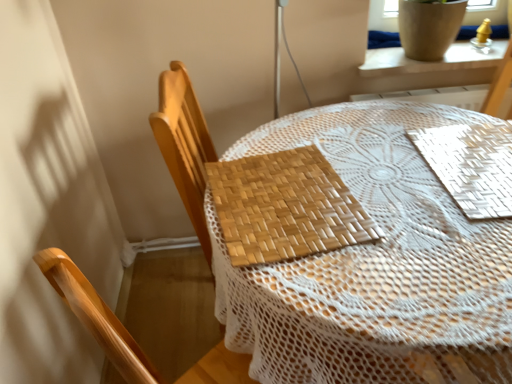
Question: From a real-world perspective, is white ceramic pot at upper right located beneath woven wood placemat at center, the 2th mat positioned from the right?

Choices:
 (A) yes
 (B) no

Answer: (B)

Question: Is white ceramic pot at upper right positioned before woven wood placemat at center, marked as the first mat in a left-to-right arrangement?

Choices:
 (A) no
 (B) yes

Answer: (A)

Question: Is white ceramic pot at upper right outside woven wood placemat at center, the 2th mat positioned from the right?

Choices:
 (A) no
 (B) yes

Answer: (B)

Question: Can you confirm if white ceramic pot at upper right is positioned to the right of woven wood placemat at center, marked as the first mat in a left-to-right arrangement?

Choices:
 (A) no
 (B) yes

Answer: (B)

Question: Is white ceramic pot at upper right taller than woven wood placemat at center, the 2th mat positioned from the right?

Choices:
 (A) no
 (B) yes

Answer: (B)

Question: Considering their positions, is white ceramic pot at upper right located in front of or behind white woven mat at upper right, arranged as the second mat when viewed from the left?

Choices:
 (A) behind
 (B) front

Answer: (A)

Question: Would you say white ceramic pot at upper right is inside or outside white woven mat at upper right, arranged as the first mat when viewed from the right?

Choices:
 (A) inside
 (B) outside

Answer: (B)

Question: From a real-world perspective, is white ceramic pot at upper right physically located above or below white woven mat at upper right, arranged as the second mat when viewed from the left?

Choices:
 (A) above
 (B) below

Answer: (A)

Question: Is white ceramic pot at upper right bigger or smaller than white woven mat at upper right, arranged as the first mat when viewed from the right?

Choices:
 (A) small
 (B) big

Answer: (B)

Question: Considering their positions, is white woven mat at upper right, arranged as the first mat when viewed from the right, located in front of or behind woven wood placemat at center, marked as the first mat in a left-to-right arrangement?

Choices:
 (A) front
 (B) behind

Answer: (B)

Question: Considering the positions of white woven mat at upper right, arranged as the first mat when viewed from the right, and woven wood placemat at center, marked as the first mat in a left-to-right arrangement, in the image, is white woven mat at upper right, arranged as the first mat when viewed from the right, bigger or smaller than woven wood placemat at center, marked as the first mat in a left-to-right arrangement,?

Choices:
 (A) small
 (B) big

Answer: (A)

Question: Would you say white woven mat at upper right, arranged as the first mat when viewed from the right, is to the left or to the right of woven wood placemat at center, the 2th mat positioned from the right, in the picture?

Choices:
 (A) left
 (B) right

Answer: (B)

Question: Would you say white woven mat at upper right, arranged as the second mat when viewed from the left, is inside or outside woven wood placemat at center, the 2th mat positioned from the right?

Choices:
 (A) inside
 (B) outside

Answer: (B)

Question: From a real-world perspective, relative to woven wood chair at center, is bamboo placemat at center vertically above or below?

Choices:
 (A) below
 (B) above

Answer: (A)

Question: Is bamboo placemat at center wider or thinner than woven wood chair at center?

Choices:
 (A) wide
 (B) thin

Answer: (A)